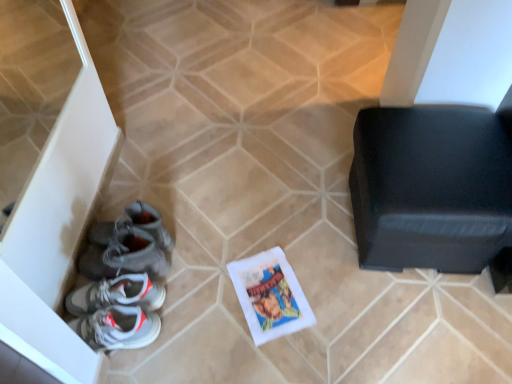
Locate an element on the screen. The image size is (512, 384). black leather ottoman at right is located at coordinates (432, 187).

What do you see at coordinates (270, 295) in the screenshot? This screenshot has width=512, height=384. I see `white paper comic book at center` at bounding box center [270, 295].

You are a GUI agent. You are given a task and a screenshot of the screen. Output one action in this format:
    pyautogui.click(x=<x>, y=<y>)
    Task: Click on the gray suede sneakers at lower left
    This screenshot has width=512, height=384.
    Given the screenshot: What is the action you would take?
    pyautogui.click(x=128, y=245)

Locate an element on the screen. Image resolution: width=512 pixels, height=384 pixels. black leather ottoman at right is located at coordinates (432, 187).

Does white paper comic book at center have a lesser height compared to black leather ottoman at right?

Yes, white paper comic book at center is shorter than black leather ottoman at right.

Where is `furniture on the right of white paper comic book at center`? furniture on the right of white paper comic book at center is located at coordinates (432, 187).

Is white paper comic book at center looking in the opposite direction of black leather ottoman at right?

No, white paper comic book at center is not facing away from black leather ottoman at right.

Can you confirm if white paper comic book at center is smaller than black leather ottoman at right?

Yes.

Who is smaller, black leather ottoman at right or gray suede sneakers at lower left?

Smaller between the two is gray suede sneakers at lower left.

From the image's perspective, is black leather ottoman at right over gray suede sneakers at lower left?

Correct, black leather ottoman at right appears higher than gray suede sneakers at lower left in the image.

Is black leather ottoman at right facing towards gray suede sneakers at lower left?

No, black leather ottoman at right is not oriented towards gray suede sneakers at lower left.

Considering the sizes of objects black leather ottoman at right and white paper comic book at center in the image provided, who is smaller, black leather ottoman at right or white paper comic book at center?

With smaller size is white paper comic book at center.

Considering the positions of points (451, 196) and (254, 338), is point (451, 196) closer to camera compared to point (254, 338)?

Yes, point (451, 196) is in front of point (254, 338).

Is black leather ottoman at right to the left of white paper comic book at center from the viewer's perspective?

No.

Consider the image. Is black leather ottoman at right inside or outside of white paper comic book at center?

black leather ottoman at right is not enclosed by white paper comic book at center.

Which object is thinner, white paper comic book at center or gray suede sneakers at lower left?

white paper comic book at center.

Would you say white paper comic book at center contains gray suede sneakers at lower left?

No, gray suede sneakers at lower left is not inside white paper comic book at center.

Which object is positioned more to the right, white paper comic book at center or gray suede sneakers at lower left?

white paper comic book at center.

Could you tell me if gray suede sneakers at lower left is turned towards white paper comic book at center?

No, gray suede sneakers at lower left is not facing towards white paper comic book at center.

Between gray suede sneakers at lower left and white paper comic book at center, which one appears on the left side from the viewer's perspective?

gray suede sneakers at lower left.

Between gray suede sneakers at lower left and white paper comic book at center, which one has smaller width?

Thinner between the two is white paper comic book at center.

Is point (110, 223) less distant than point (419, 129)?

No, (110, 223) is further to viewer.

Is black leather ottoman at right at the back of gray suede sneakers at lower left?

Yes, black leather ottoman at right is at the back of gray suede sneakers at lower left.

Consider the image. How many degrees apart are the facing directions of gray suede sneakers at lower left and black leather ottoman at right?

The angle between the facing direction of gray suede sneakers at lower left and the facing direction of black leather ottoman at right is 86.3 degrees.

This screenshot has height=384, width=512. In order to click on footwear that is below the black leather ottoman at right (from the image's perspective) in this screenshot , I will do `click(128, 245)`.

Where is `comic book beneath the black leather ottoman at right (from a real-world perspective)`? The width and height of the screenshot is (512, 384). comic book beneath the black leather ottoman at right (from a real-world perspective) is located at coordinates (270, 295).

The height and width of the screenshot is (384, 512). I want to click on furniture above the gray suede sneakers at lower left (from the image's perspective), so click(x=432, y=187).

Which object lies further to the anchor point white paper comic book at center, black leather ottoman at right or gray suede sneakers at lower left?

The object further to white paper comic book at center is black leather ottoman at right.

Looking at the image, which one is located closer to gray suede sneakers at lower left, white paper comic book at center or black leather ottoman at right?

white paper comic book at center is closer to gray suede sneakers at lower left.

Looking at the image, which one is located further to white paper comic book at center, gray suede sneakers at lower left or black leather ottoman at right?

black leather ottoman at right.

When comparing their distances from black leather ottoman at right, does gray suede sneakers at lower left or white paper comic book at center seem closer?

Based on the image, white paper comic book at center appears to be nearer to black leather ottoman at right.

Based on their spatial positions, is white paper comic book at center or gray suede sneakers at lower left closer to black leather ottoman at right?

The object closer to black leather ottoman at right is white paper comic book at center.

Based on their spatial positions, is black leather ottoman at right or white paper comic book at center closer to gray suede sneakers at lower left?

white paper comic book at center.

This screenshot has width=512, height=384. What are the coordinates of `comic book between gray suede sneakers at lower left and black leather ottoman at right` in the screenshot? It's located at (270, 295).